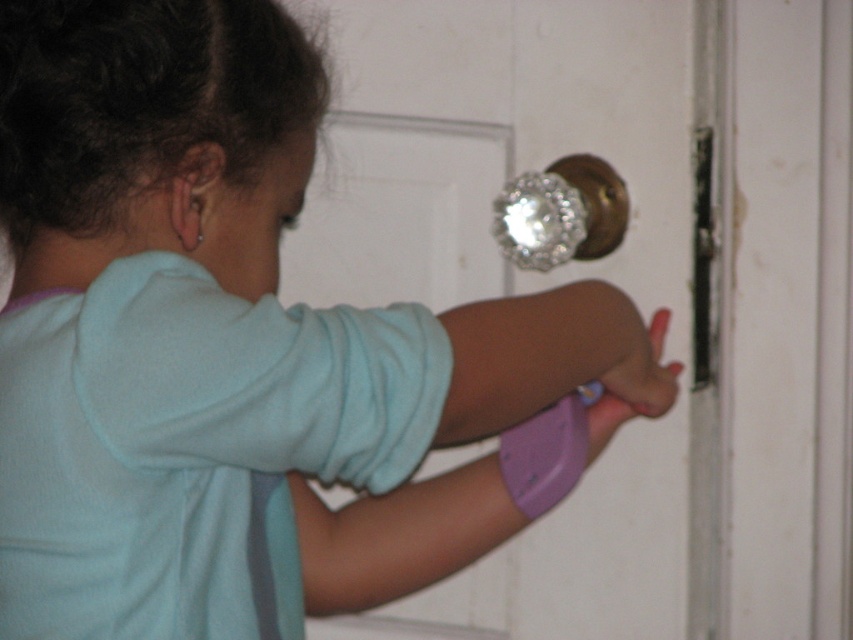
Does shiny brass doorknob at center have a greater height compared to purple matte wristband at lower center?

Correct, shiny brass doorknob at center is much taller as purple matte wristband at lower center.

Is shiny brass doorknob at center wider than purple matte wristband at lower center?

Yes, shiny brass doorknob at center is wider than purple matte wristband at lower center.

Between point (422, 621) and point (654, 353), which one is positioned in front?

Point (654, 353)

Identify the location of shiny brass doorknob at center. The height and width of the screenshot is (640, 853). (624, 285).

Who is positioned more to the right, shiny brass doorknob at center or dull metallic knob at upper right?

shiny brass doorknob at center

Does shiny brass doorknob at center have a larger size compared to dull metallic knob at upper right?

Indeed, shiny brass doorknob at center has a larger size compared to dull metallic knob at upper right.

Does point (384, 250) come farther from viewer compared to point (506, 202)?

Yes.

Locate an element on the screen. The height and width of the screenshot is (640, 853). shiny brass doorknob at center is located at coordinates (624, 285).

Does dull metallic knob at upper right appear on the right side of purple matte wristband at lower center?

No, dull metallic knob at upper right is not to the right of purple matte wristband at lower center.

Can you confirm if dull metallic knob at upper right is positioned below purple matte wristband at lower center?

No.

What do you see at coordinates (561, 212) in the screenshot? I see `dull metallic knob at upper right` at bounding box center [561, 212].

Image resolution: width=853 pixels, height=640 pixels. Identify the location of dull metallic knob at upper right. (561, 212).